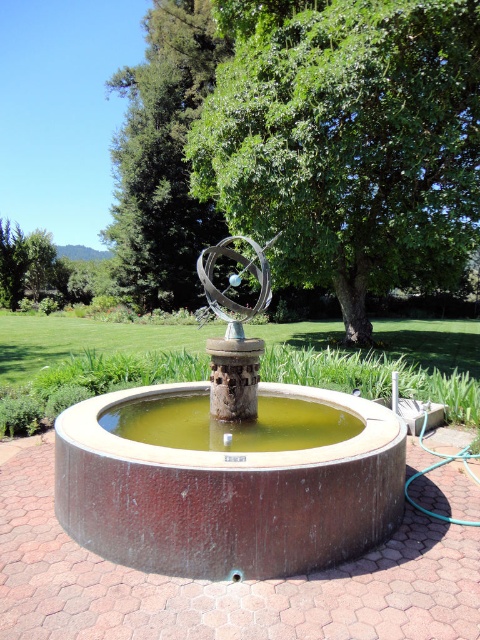
You are a landscape architect planning to install a new lighting system around the fountain. You have two spotlights, one for the green leafy tree at center and another for the metallic sculpture at center. Which object should you place the spotlight higher to ensure it reaches the top?

The green leafy tree at center is taller than the metallic sculpture at center, so the spotlight for the green leafy tree at center should be placed higher to reach its top.

You are designing a garden layout and need to place a new bench between the green leafy tree at center and the metallic sculpture at center. Given that the bench requires 1.5 meters of space to fit, can the space between them accommodate it based on their sizes?

The green leafy tree at center is wider than the metallic sculpture at center. Since the bench needs 1.5 meters of space, the combined width of both objects might leave enough room. However, without exact measurements, it is uncertain. Please verify the actual dimensions.